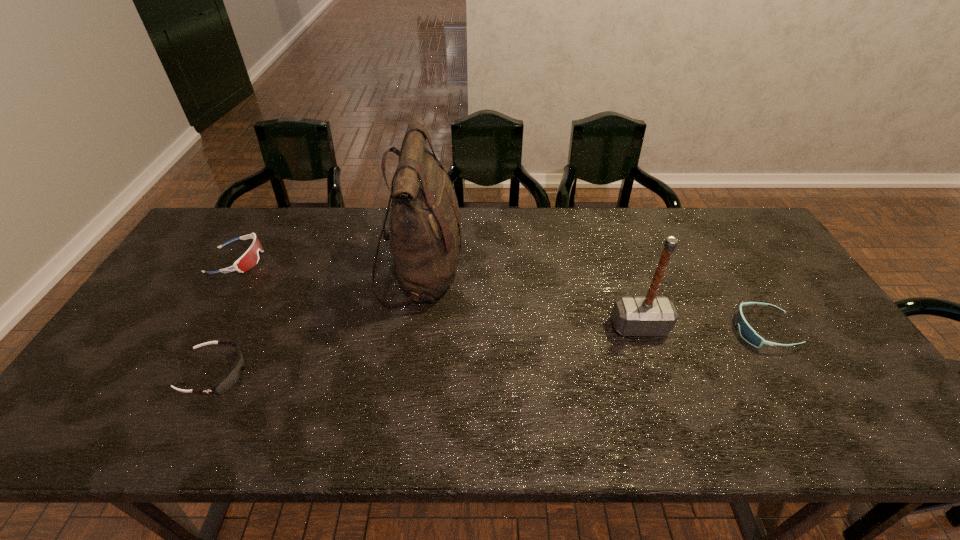
Find the location of `the third object from left to right`. the third object from left to right is located at coordinates (425, 236).

Identify the location of the tallest object. (425, 236).

Image resolution: width=960 pixels, height=540 pixels. I want to click on the fourth shortest object, so click(x=650, y=315).

In order to click on the second object from right to left in this screenshot , I will do `click(650, 315)`.

Find the location of a particular element. The image size is (960, 540). the farthest goggles is located at coordinates (250, 258).

Find the location of a particular element. The image size is (960, 540). the third tallest object is located at coordinates (250, 258).

Find the location of a particular element. The width and height of the screenshot is (960, 540). the rightmost goggles is located at coordinates (746, 331).

Image resolution: width=960 pixels, height=540 pixels. I want to click on vacant point located on the open flap of the backpack, so click(526, 273).

Identify the location of free space located 0.190m on the striking surface of the hammer. This screenshot has width=960, height=540. (665, 404).

I want to click on vacant space located on the front-facing side of the tallest goggles, so click(340, 260).